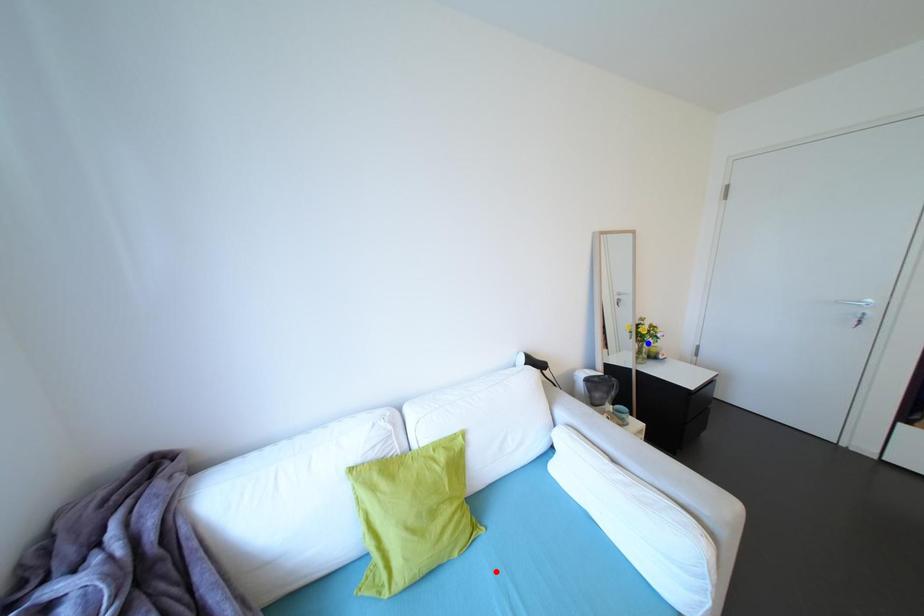
Question: In the image, two points are highlighted. Which point is nearer to the camera? Reply with the corresponding letter.

Choices:
 (A) blue point
 (B) red point

Answer: (B)